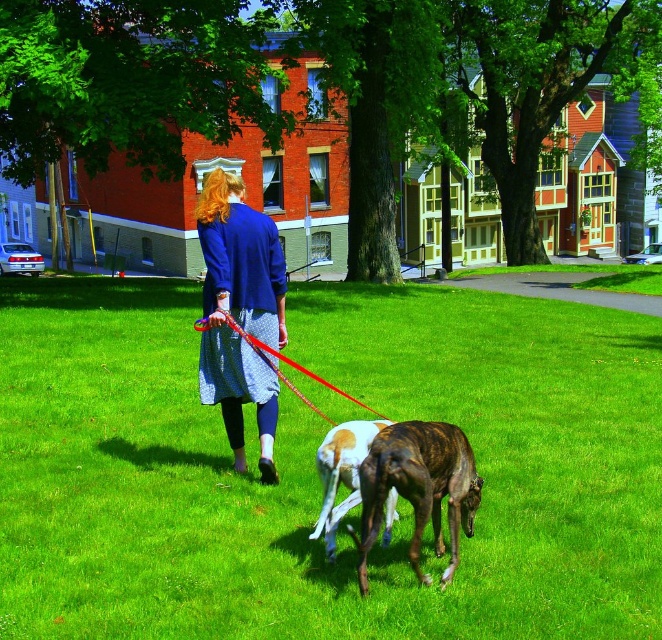
Question: Which point is closer to the camera?

Choices:
 (A) rubber red leash at center
 (B) brown and white fur at center

Answer: (B)

Question: Observing the image, what is the correct spatial positioning of brindle fur dog at center in reference to rubber red leash at center?

Choices:
 (A) right
 (B) left

Answer: (A)

Question: Is green grass at center to the right of brindle fur dog at center from the viewer's perspective?

Choices:
 (A) yes
 (B) no

Answer: (B)

Question: Which point is farther to the camera?

Choices:
 (A) rubber red leash at center
 (B) brown and white fur at center
 (C) blue cotton jacket at center
 (D) green grass at center

Answer: (C)

Question: Can you confirm if green grass at center is wider than brindle fur dog at center?

Choices:
 (A) yes
 (B) no

Answer: (A)

Question: Which of these objects is positioned closest to the rubber red leash at center?

Choices:
 (A) brown and white fur at center
 (B) green grass at center

Answer: (A)